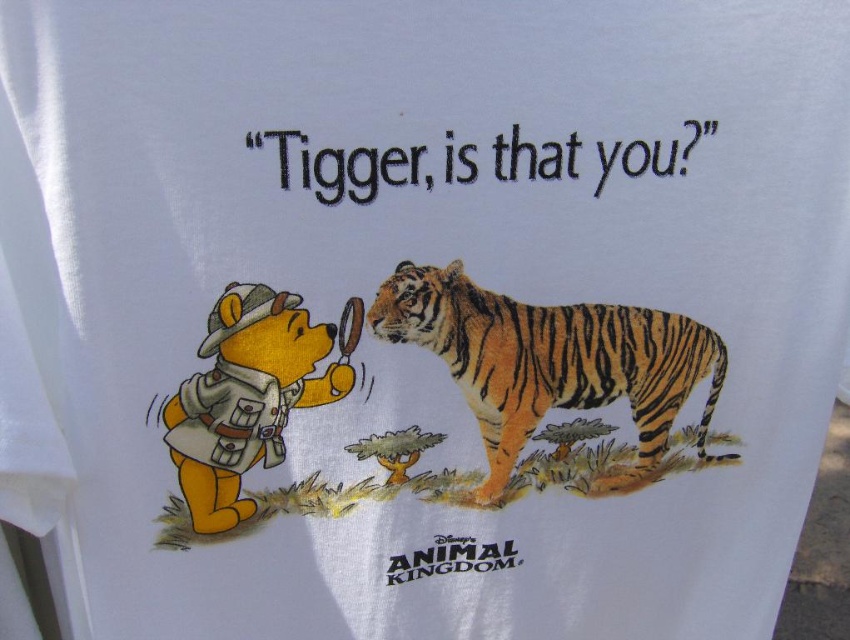
Who is positioned more to the right, orange-brown striped tiger at center or matte yellow bear at left?

Positioned to the right is orange-brown striped tiger at center.

Is point (421, 284) farther from camera compared to point (221, 392)?

Yes.

Is point (474, 365) farther from viewer compared to point (196, 472)?

Yes.

Identify the location of orange-brown striped tiger at center. (551, 362).